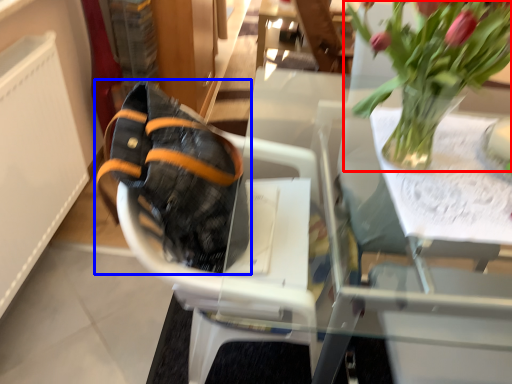
Question: Which of the following is the farthest to the observer, houseplant (highlighted by a red box) or footwear (highlighted by a blue box)?

Choices:
 (A) houseplant
 (B) footwear

Answer: (B)